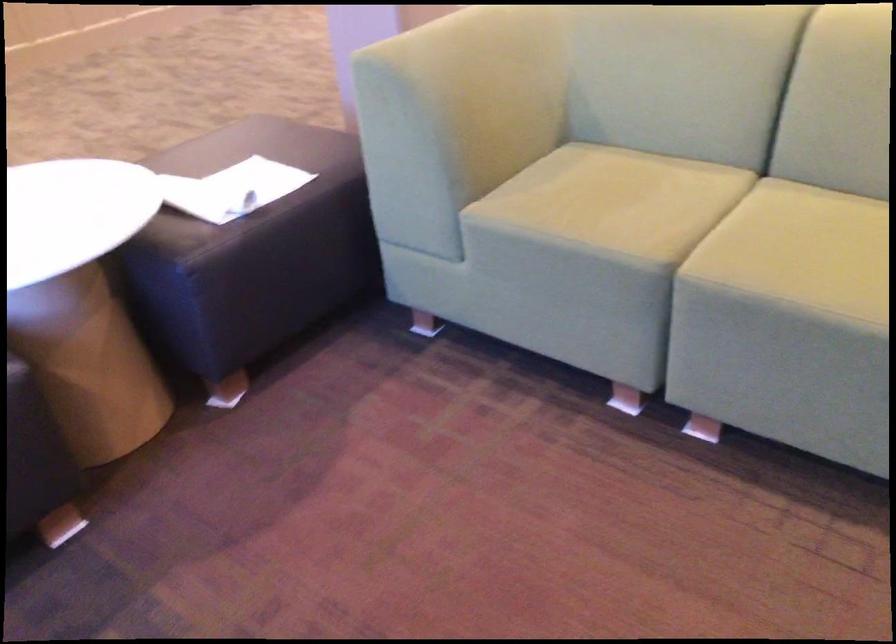
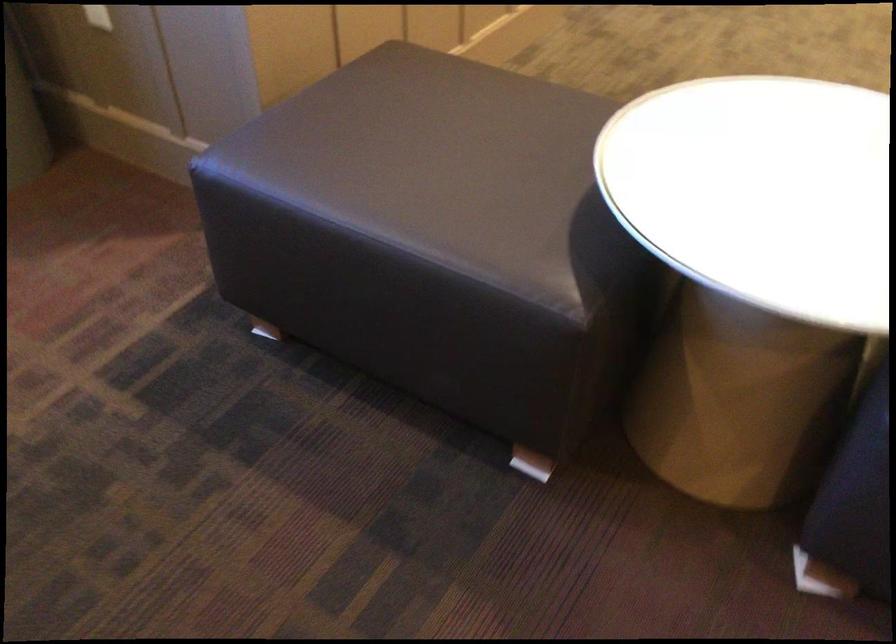
First-person continuous shooting, in which direction is the camera rotating?

The rotation direction of the camera is left-down.